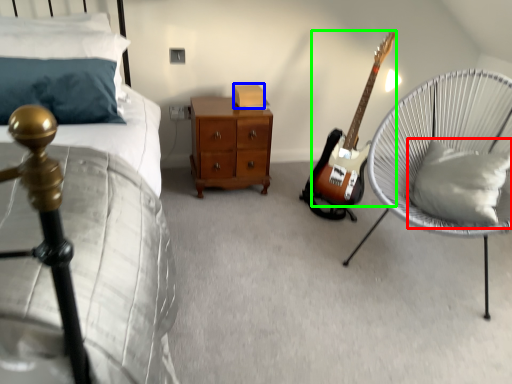
Question: Based on their relative distances, which object is farther from pillow (highlighted by a red box)? Choose from box (highlighted by a blue box) and guitar (highlighted by a green box).

Choices:
 (A) box
 (B) guitar

Answer: (A)